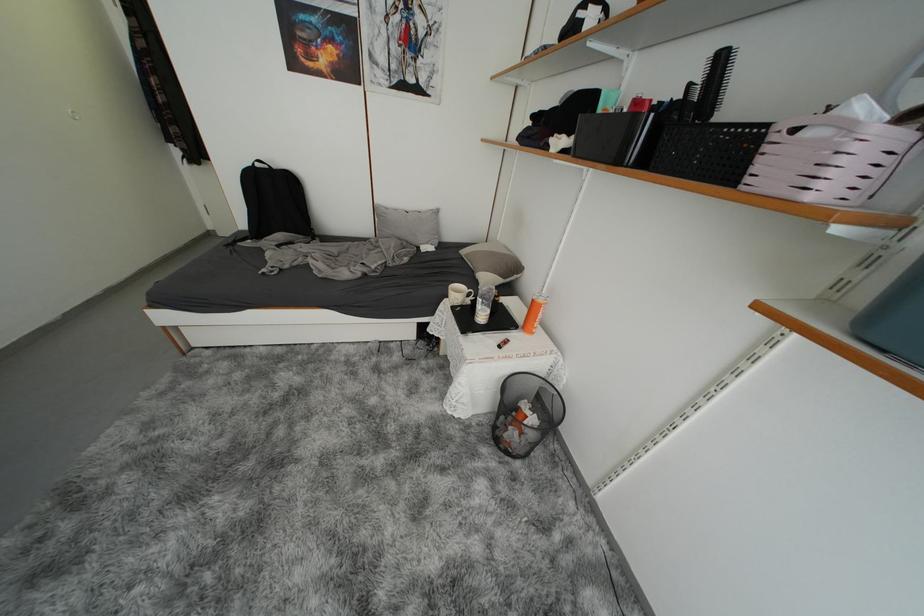
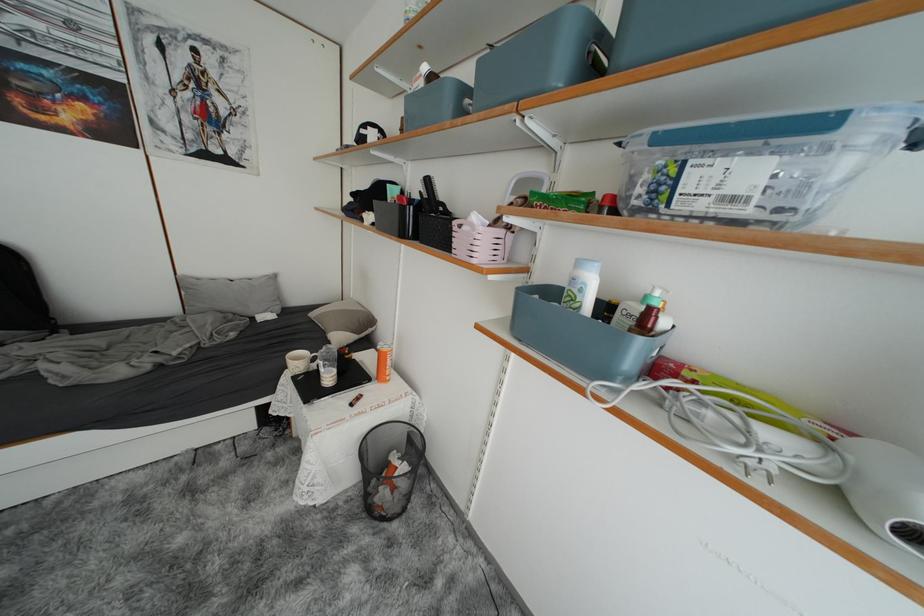
Where in the second image is the point corresponding to [505,428] from the first image?

(375, 493)